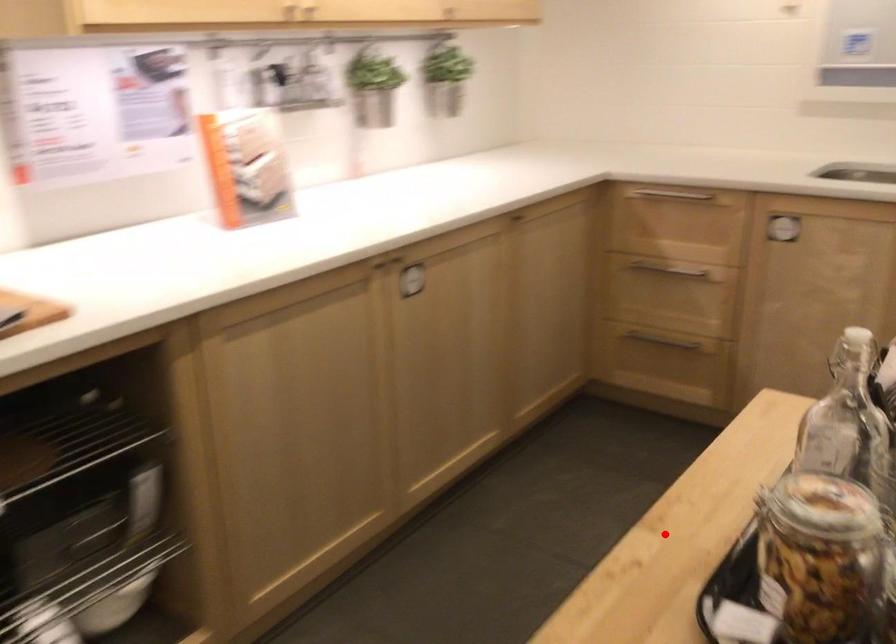
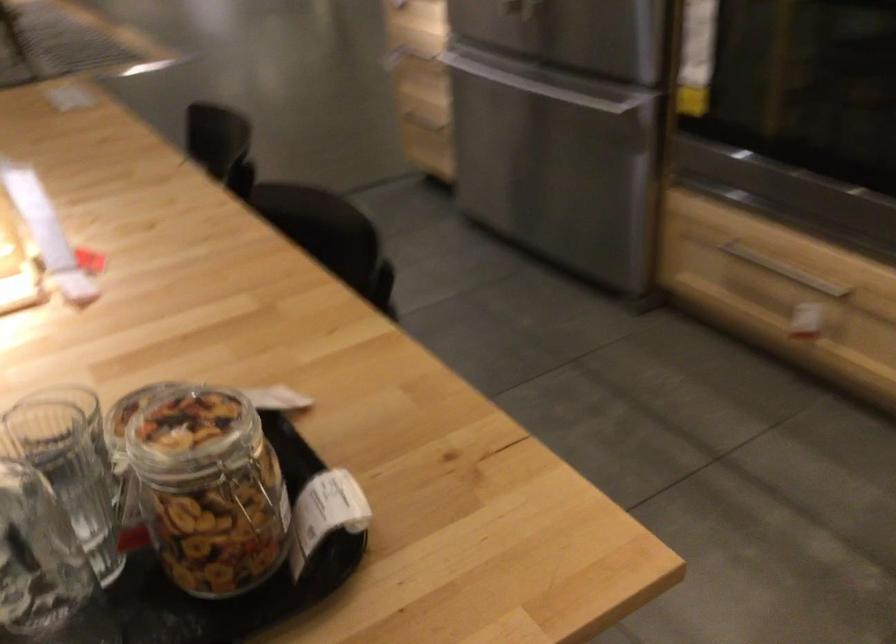
Question: I am providing you with two images of the same scene from different viewpoints. In image1, a red point is highlighted. Considering the same 3D point in image2, which of the following is correct?

Choices:
 (A) It is closer
 (B) It is farther

Answer: (A)